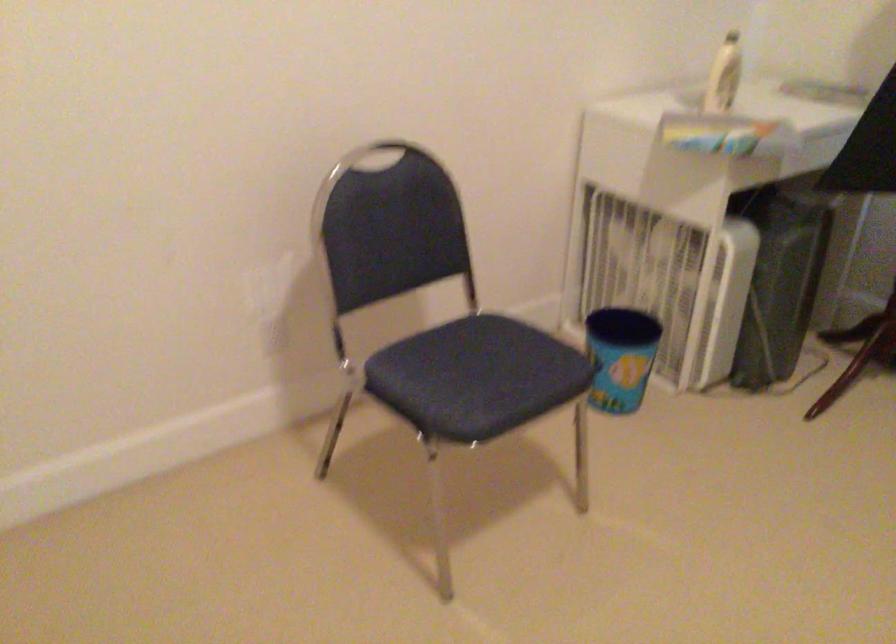
The location [619,357] corresponds to which object?

It refers to a blue plastic bucket.